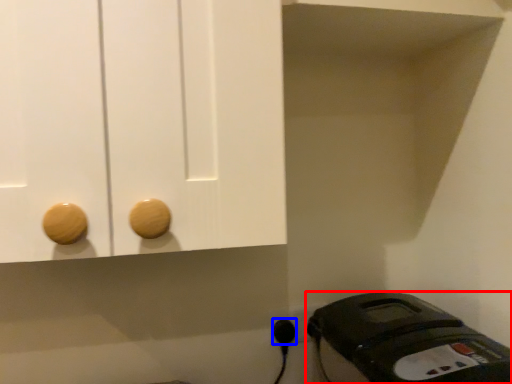
Question: Which object appears farthest to the camera in this image, home appliance (highlighted by a red box) or plug (highlighted by a blue box)?

Choices:
 (A) home appliance
 (B) plug

Answer: (B)